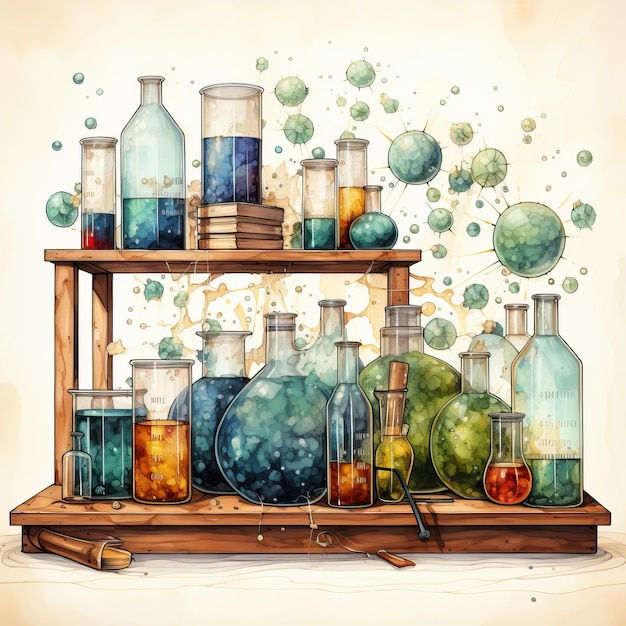
I want to click on table, so coord(245,585).